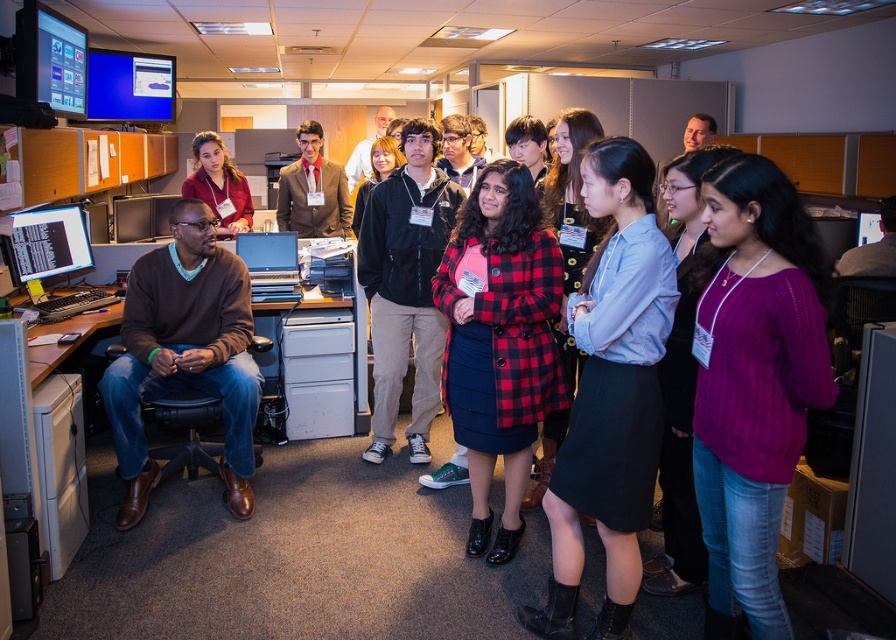
Question: Is brown sweater at left to the right of blue glossy monitor at upper left from the viewer's perspective?

Choices:
 (A) yes
 (B) no

Answer: (A)

Question: Can you confirm if brown sweater at left is positioned to the left of matte black laptop at center?

Choices:
 (A) yes
 (B) no

Answer: (A)

Question: Which point is closer to the camera?

Choices:
 (A) (125, 454)
 (B) (571, 524)
 (C) (553, 268)

Answer: (B)

Question: Which point appears farthest from the camera in this image?

Choices:
 (A) (76, 218)
 (B) (158, 116)
 (C) (745, 291)
 (D) (71, 109)

Answer: (B)

Question: Which point is farther from the camera taking this photo?

Choices:
 (A) (295, 282)
 (B) (295, 177)
 (C) (797, 337)

Answer: (B)

Question: Is light blue cotton shirt at center positioned in front of matte black monitor at upper left?

Choices:
 (A) yes
 (B) no

Answer: (A)